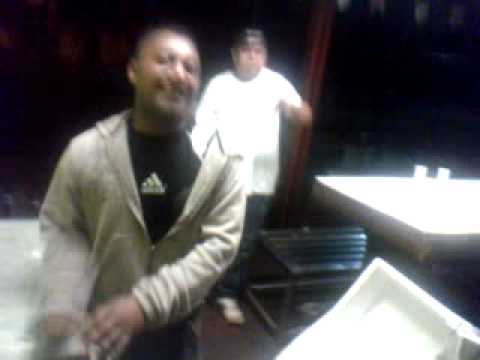
The image size is (480, 360). I want to click on bench, so click(x=292, y=248).